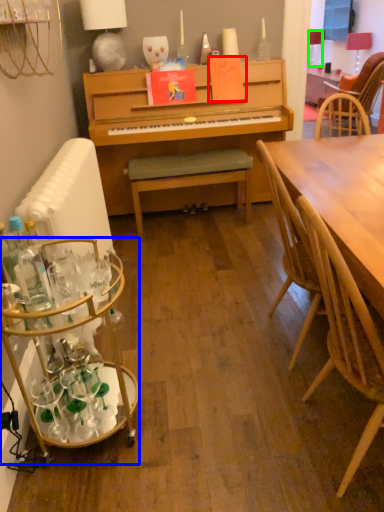
Question: Which is farther away from book (highlighted by a red box)? desk (highlighted by a blue box) or lamp (highlighted by a green box)?

Choices:
 (A) desk
 (B) lamp

Answer: (B)